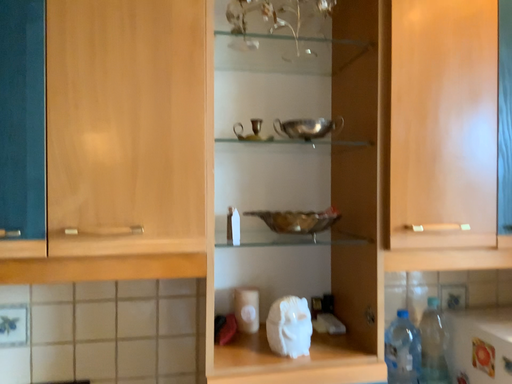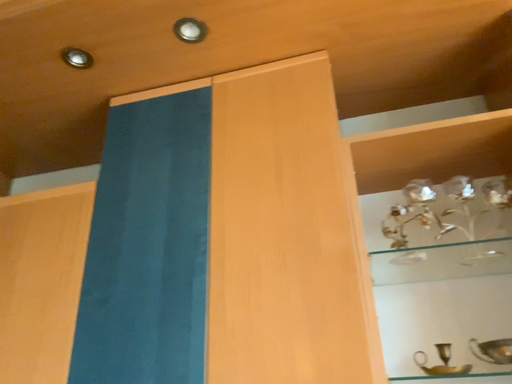
Question: How did the camera likely rotate when shooting the video?

Choices:
 (A) rotated downward
 (B) rotated upward

Answer: (B)